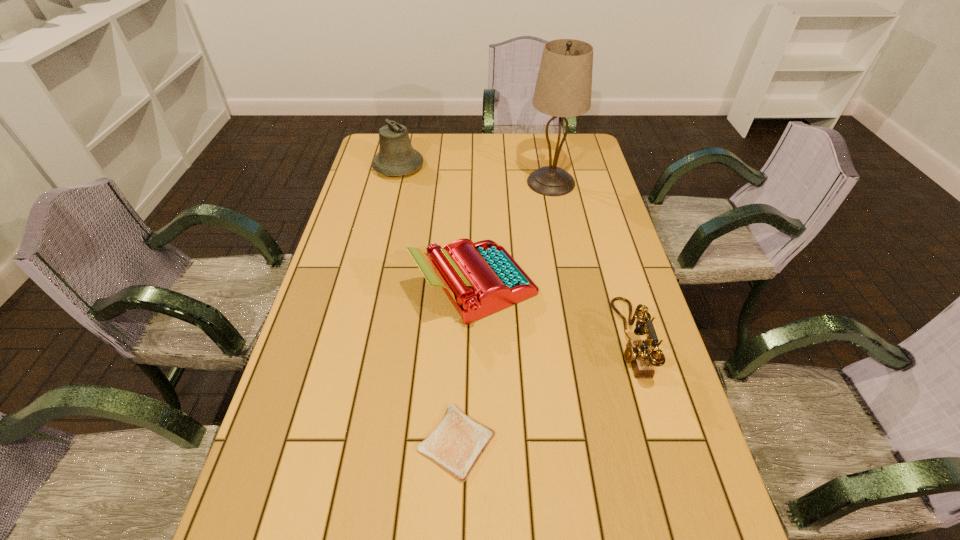
Image resolution: width=960 pixels, height=540 pixels. Find the location of `free spot between the bell and the shortest object`. free spot between the bell and the shortest object is located at coordinates (427, 305).

This screenshot has width=960, height=540. I want to click on vacant area that lies between the leftmost object and the toast, so click(427, 305).

At what (x,y) coordinates should I click in order to perform the action: click on free spot between the leftmost object and the nearest object. Please return your answer as a coordinate pair (x, y). Looking at the image, I should click on (427, 305).

Identify the location of vacant area between the typewriter and the fourth tallest object. (553, 313).

The width and height of the screenshot is (960, 540). In order to click on empty space that is in between the lampshade and the typewriter in this screenshot , I will do `click(514, 234)`.

At what (x,y) coordinates should I click in order to perform the action: click on object that stands as the fourth closest to the third shortest object. Please return your answer as a coordinate pair (x, y). The height and width of the screenshot is (540, 960). Looking at the image, I should click on (396, 157).

Image resolution: width=960 pixels, height=540 pixels. What are the coordinates of `object that is the closest to the typewriter` in the screenshot? It's located at (637, 353).